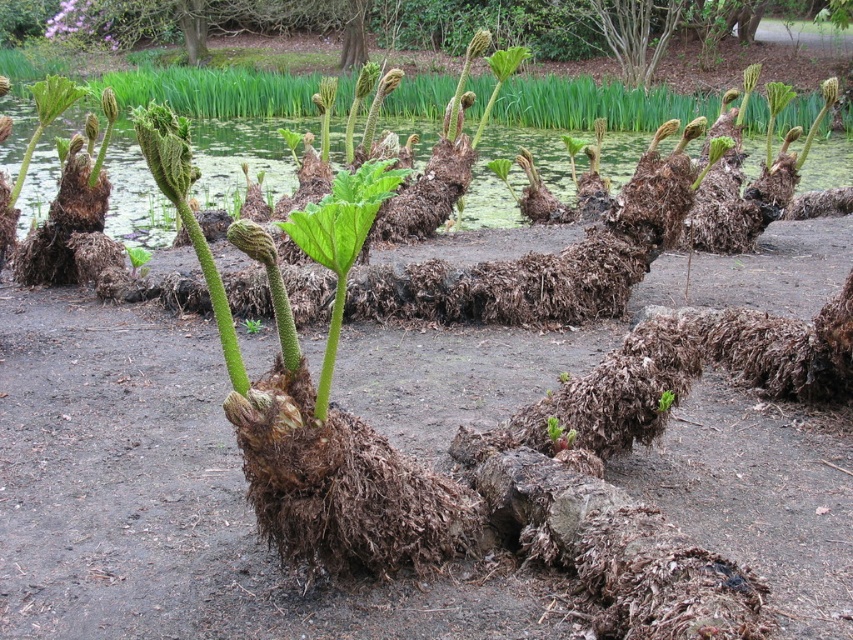
Between green matte leafy plant at center and green fuzzy fern at center, which one is positioned lower?

Positioned lower is green fuzzy fern at center.

What are the coordinates of `green matte leafy plant at center` in the screenshot? It's located at (340, 241).

Based on the photo, can you confirm if green mossy water at center is positioned below green matte leafy plant at center?

Incorrect, green mossy water at center is not positioned below green matte leafy plant at center.

Which is more to the right, green mossy water at center or green matte leafy plant at center?

green mossy water at center is more to the right.

Describe the element at coordinates (242, 156) in the screenshot. I see `green mossy water at center` at that location.

Locate an element on the screen. green mossy water at center is located at coordinates (242, 156).

Can you confirm if green mossy water at center is wider than green fuzzy fern at center?

Correct, the width of green mossy water at center exceeds that of green fuzzy fern at center.

Is point (401, 140) farther from camera compared to point (670, 397)?

Yes, point (401, 140) is behind point (670, 397).

Where is `green mossy water at center`? This screenshot has width=853, height=640. green mossy water at center is located at coordinates (242, 156).